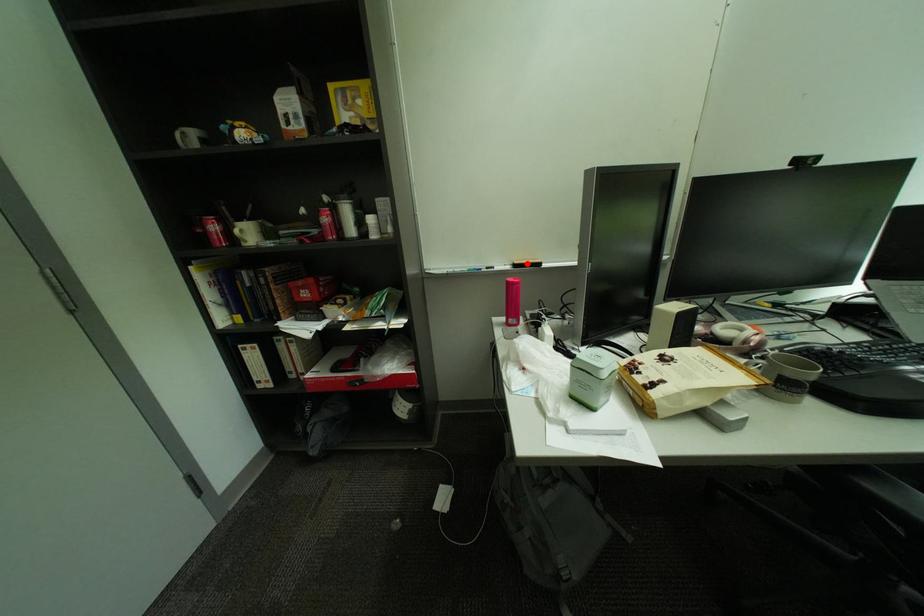
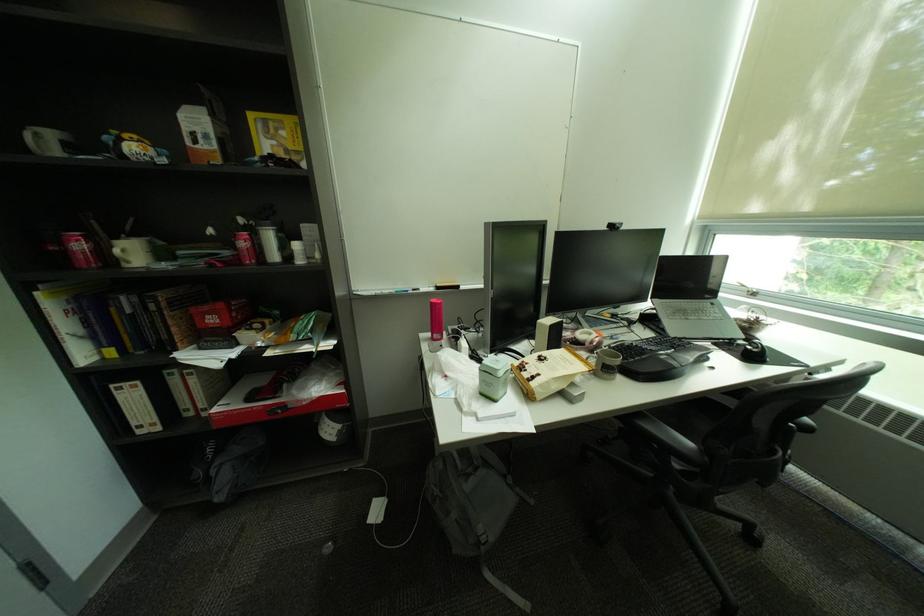
Question: I am providing you with two images of the same scene from different viewpoints. A red point is marked on the first image. Is the red point's position out of view in image 2?

Choices:
 (A) Yes
 (B) No

Answer: (B)